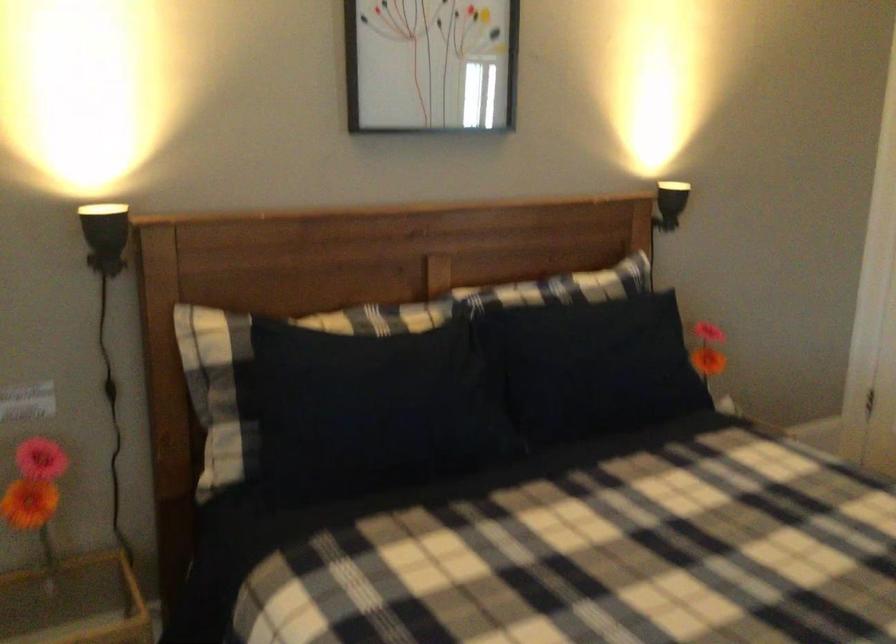
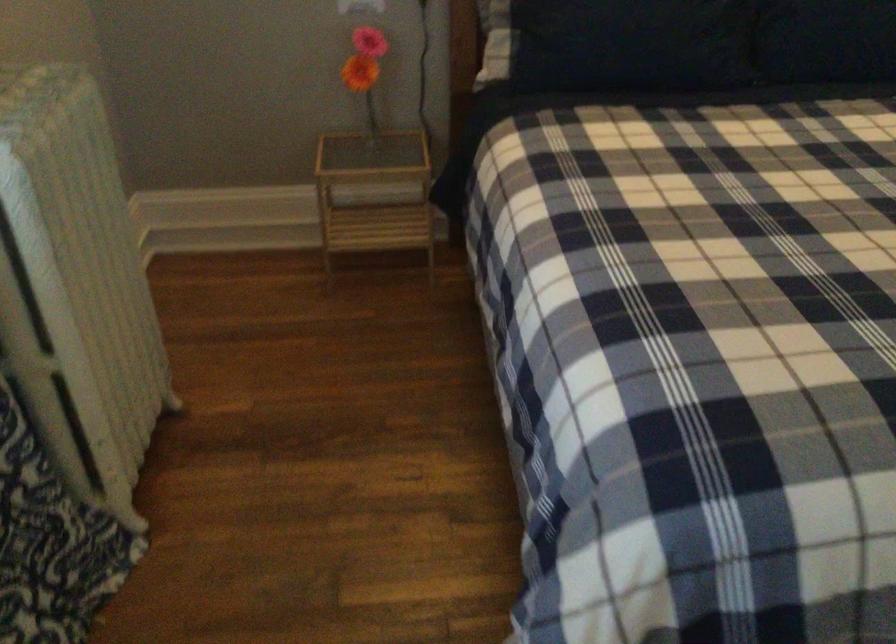
Where in the second image is the point corresponding to (409,426) from the first image?

(631, 44)